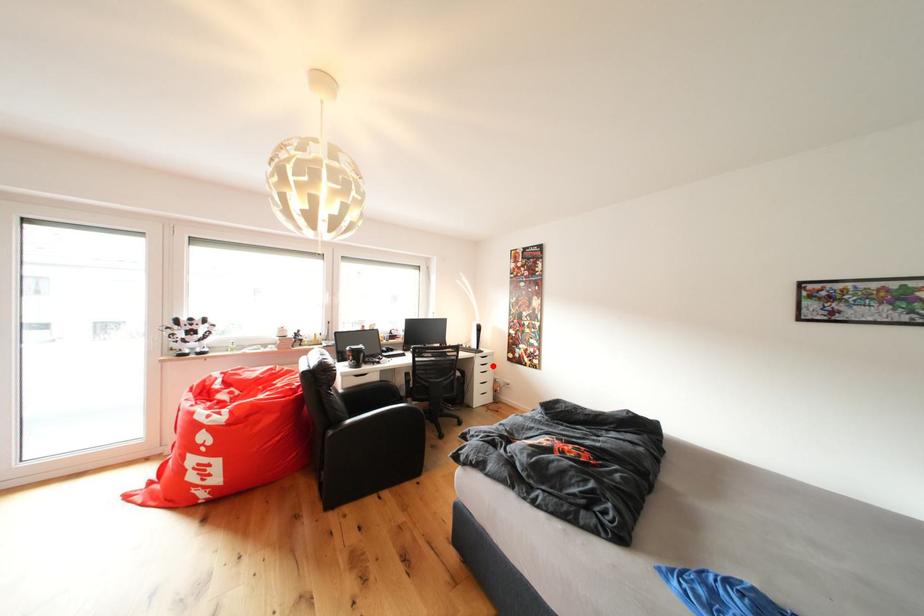
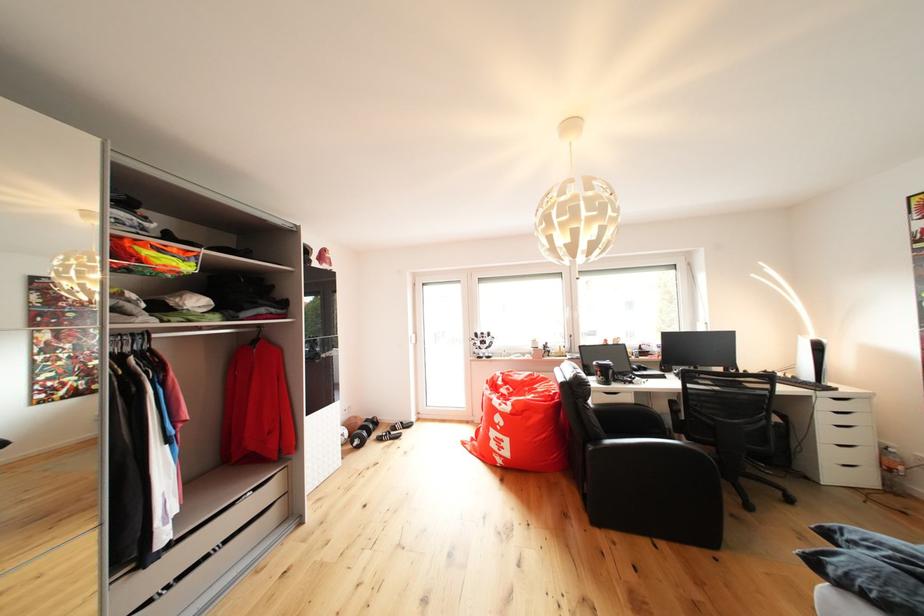
Question: A red point is marked in image1. In image2, is the corresponding 3D point closer to the camera or farther? Reply with the corresponding letter.

Choices:
 (A) The corresponding 3D point is closer.
 (B) The corresponding 3D point is farther.

Answer: (A)